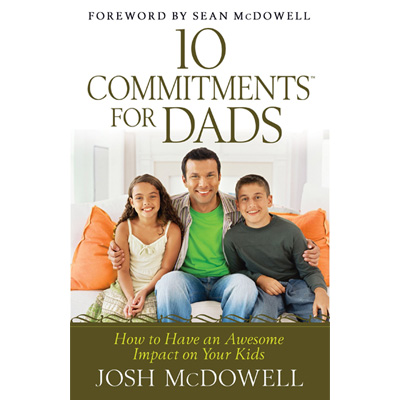
Image resolution: width=400 pixels, height=400 pixels. Identify the location of couch. (117, 207).